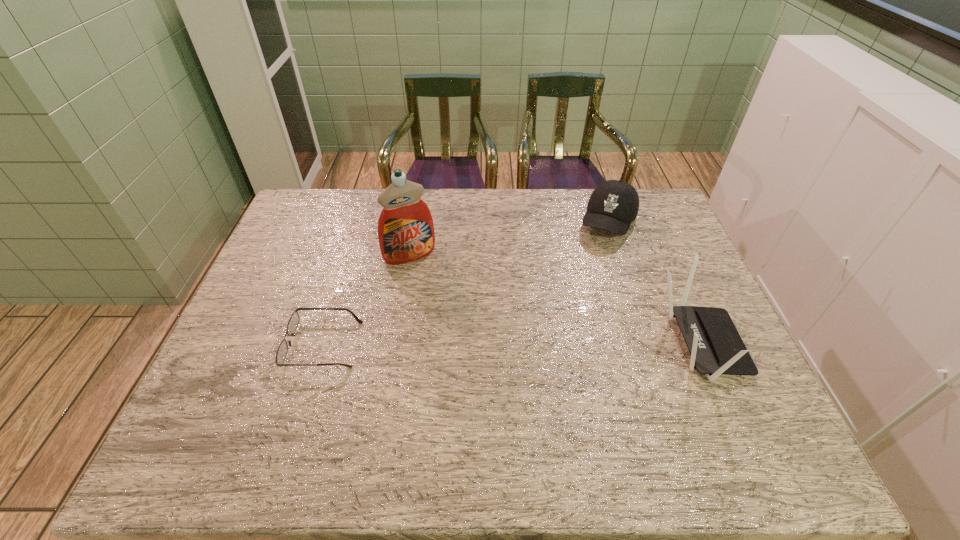
Where is `the leftmost object`? This screenshot has height=540, width=960. the leftmost object is located at coordinates (293, 322).

The image size is (960, 540). Identify the location of spectacles. (293, 322).

The width and height of the screenshot is (960, 540). Identify the location of router. [716, 347].

The height and width of the screenshot is (540, 960). I want to click on the second shortest object, so (x=613, y=205).

The image size is (960, 540). What are the coordinates of `the third object from right to left` in the screenshot? It's located at [406, 233].

Identify the location of detergent. This screenshot has width=960, height=540. (406, 233).

The height and width of the screenshot is (540, 960). In order to click on vacant area situated 0.110m on the front-facing side of the shortest object in this screenshot , I will do `click(246, 345)`.

Find the location of a particular element. Image resolution: width=960 pixels, height=540 pixels. vacant space situated on the front-facing side of the shortest object is located at coordinates (242, 345).

Where is `vacant space positioned 0.350m on the front-facing side of the second shortest object`? This screenshot has height=540, width=960. vacant space positioned 0.350m on the front-facing side of the second shortest object is located at coordinates (567, 320).

The height and width of the screenshot is (540, 960). In order to click on free spot located on the front-facing side of the second shortest object in this screenshot , I will do pyautogui.click(x=579, y=294).